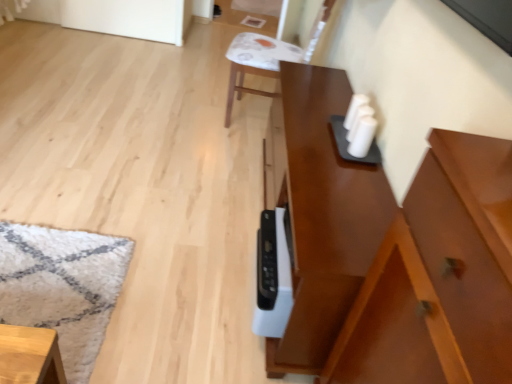
You are a GUI agent. You are given a task and a screenshot of the screen. Output one action in this format:
    pyautogui.click(x=<x>, y=<y>)
    Task: Click on the space that is in front of white fabric chair at upper center
    The width and height of the screenshot is (512, 384).
    Given the screenshot: What is the action you would take?
    pyautogui.click(x=222, y=145)